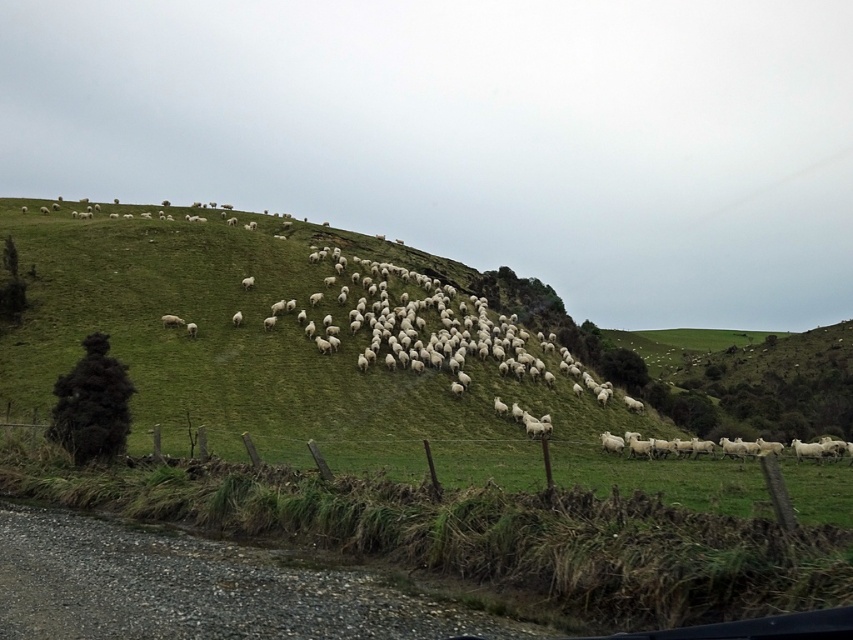
Measure the distance between wooden posts at lower left and camera.

They are 10.76 meters apart.

Where is `wooden posts at lower left`? The height and width of the screenshot is (640, 853). wooden posts at lower left is located at coordinates (663, 476).